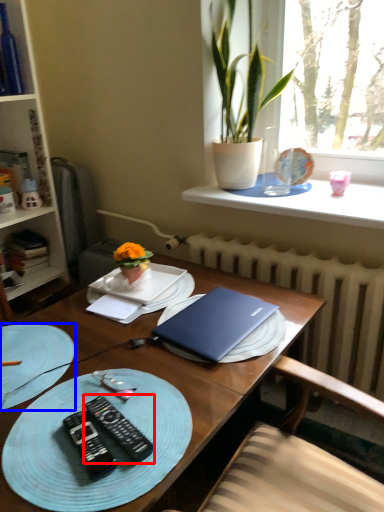
Question: Which of the following is the farthest to the observer, remote control (highlighted by a red box) or tableware (highlighted by a blue box)?

Choices:
 (A) remote control
 (B) tableware

Answer: (B)